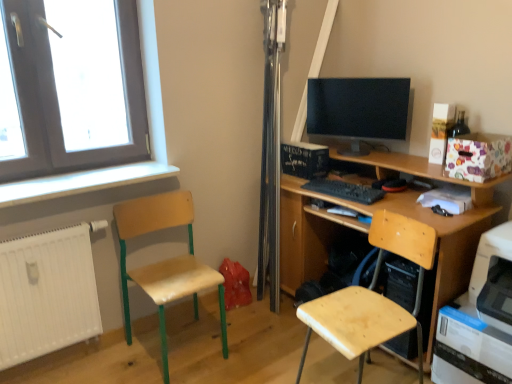
Question: Can you confirm if matte black monitor at center is positioned to the left of white painted wood at left?

Choices:
 (A) no
 (B) yes

Answer: (A)

Question: Could you tell me if matte black monitor at center is facing white painted wood at left?

Choices:
 (A) yes
 (B) no

Answer: (B)

Question: From a real-world perspective, is matte black monitor at center on top of white painted wood at left?

Choices:
 (A) yes
 (B) no

Answer: (A)

Question: Is matte black monitor at center closer to camera compared to white painted wood at left?

Choices:
 (A) no
 (B) yes

Answer: (A)

Question: Is the depth of matte black monitor at center greater than that of white painted wood at left?

Choices:
 (A) no
 (B) yes

Answer: (B)

Question: Considering the relative sizes of matte black monitor at center and white painted wood at left in the image provided, is matte black monitor at center smaller than white painted wood at left?

Choices:
 (A) yes
 (B) no

Answer: (B)

Question: Is wooden desk at center directly adjacent to white plastic printer at lower right?

Choices:
 (A) yes
 (B) no

Answer: (B)

Question: Is wooden desk at center behind white plastic printer at lower right?

Choices:
 (A) yes
 (B) no

Answer: (A)

Question: Does wooden desk at center appear on the left side of white plastic printer at lower right?

Choices:
 (A) yes
 (B) no

Answer: (A)

Question: Is wooden desk at center not within white plastic printer at lower right?

Choices:
 (A) no
 (B) yes

Answer: (B)

Question: Are wooden desk at center and white plastic printer at lower right far apart?

Choices:
 (A) no
 (B) yes

Answer: (A)

Question: Is white plastic printer at lower right inside wooden desk at center?

Choices:
 (A) yes
 (B) no

Answer: (B)

Question: From a real-world perspective, is wooden seat at left, the 1th chair positioned from the left, over white plastic printer at lower right?

Choices:
 (A) no
 (B) yes

Answer: (B)